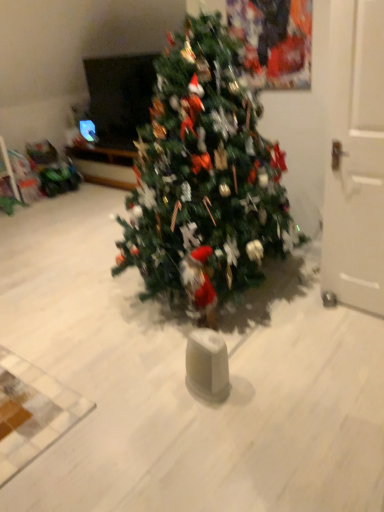
Image resolution: width=384 pixels, height=512 pixels. I want to click on vacant space behind white matte door at right, so click(x=305, y=282).